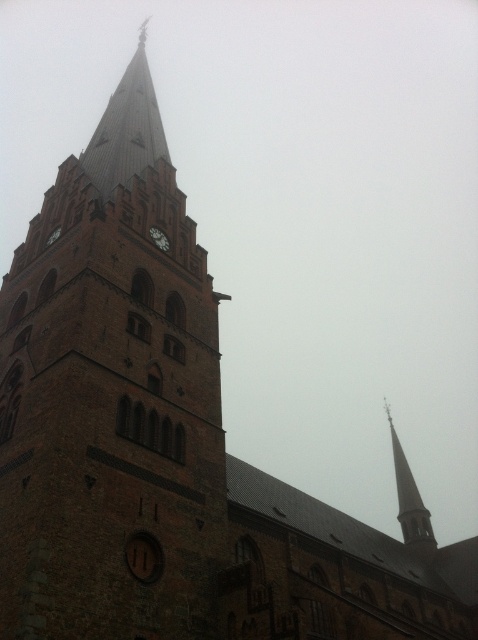
Who is positioned more to the left, brown brick tower at center or matte brown clock at center?

brown brick tower at center is more to the left.

Which is behind, point (74, 250) or point (160, 234)?

Point (160, 234)

Where is `brown brick tower at center`? The width and height of the screenshot is (478, 640). brown brick tower at center is located at coordinates (111, 400).

Can you confirm if smooth gray spire at upper right is taller than matte brown clock at center?

Indeed, smooth gray spire at upper right has a greater height compared to matte brown clock at center.

Is smooth gray spire at upper right to the right of matte brown clock at center from the viewer's perspective?

Yes, smooth gray spire at upper right is to the right of matte brown clock at center.

This screenshot has width=478, height=640. What do you see at coordinates (410, 500) in the screenshot? I see `smooth gray spire at upper right` at bounding box center [410, 500].

Locate an element on the screen. smooth gray spire at upper right is located at coordinates pos(410,500).

Is brown brick tower at center closer to the viewer compared to smooth gray spire at upper right?

Yes, brown brick tower at center is closer to the viewer.

Is brown brick tower at center shorter than smooth gray spire at upper right?

In fact, brown brick tower at center may be taller than smooth gray spire at upper right.

Identify the location of brown brick tower at center. (111, 400).

You are a GUI agent. You are given a task and a screenshot of the screen. Output one action in this format:
    pyautogui.click(x=<x>, y=<y>)
    Task: Click on the brown brick tower at center
    This screenshot has width=478, height=640.
    Given the screenshot: What is the action you would take?
    pyautogui.click(x=111, y=400)